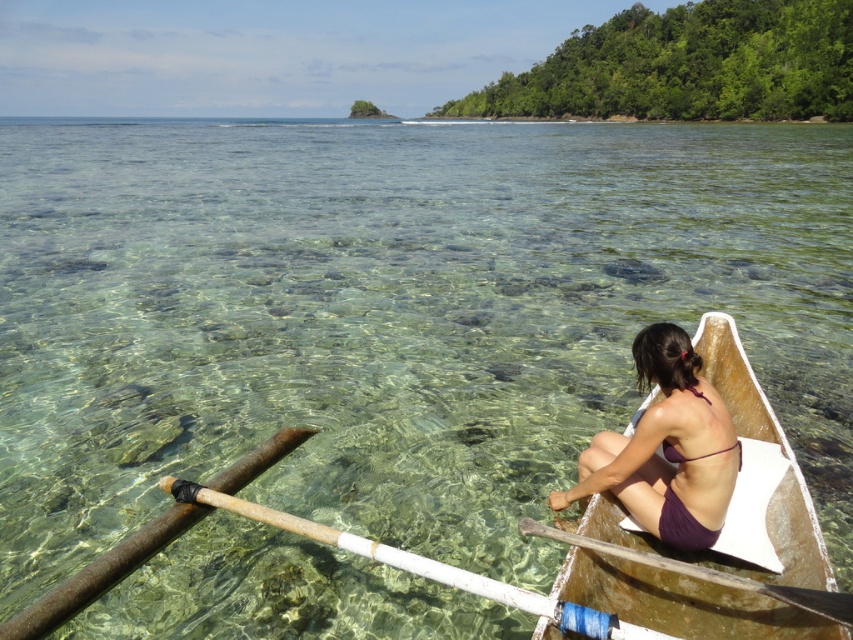
Can you confirm if wooden canoe at right is smaller than wooden paddle at lower center?

Incorrect, wooden canoe at right is not smaller in size than wooden paddle at lower center.

Is wooden canoe at right taller than wooden paddle at lower center?

Yes.

Which is in front, point (764, 605) or point (279, 528)?

Point (764, 605)

The height and width of the screenshot is (640, 853). I want to click on wooden canoe at right, so click(746, 436).

Can you confirm if purple bikini at center is wider than wooden paddle at lower center?

Incorrect, purple bikini at center's width does not surpass wooden paddle at lower center's.

Can you confirm if purple bikini at center is smaller than wooden paddle at lower center?

Yes, purple bikini at center is smaller than wooden paddle at lower center.

Does point (651, 440) come in front of point (627, 636)?

No, (651, 440) is behind (627, 636).

Identify the location of purple bikini at center. The height and width of the screenshot is (640, 853). (666, 449).

Does wooden canoe at right appear under wooden paddle at lower right?

No, wooden canoe at right is not below wooden paddle at lower right.

Where is `wooden canoe at right`? This screenshot has height=640, width=853. wooden canoe at right is located at coordinates pos(746,436).